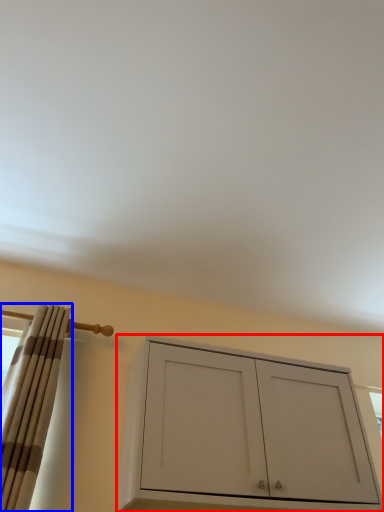
Question: Which object appears farthest to the camera in this image, cabinetry (highlighted by a red box) or curtain (highlighted by a blue box)?

Choices:
 (A) cabinetry
 (B) curtain

Answer: (A)